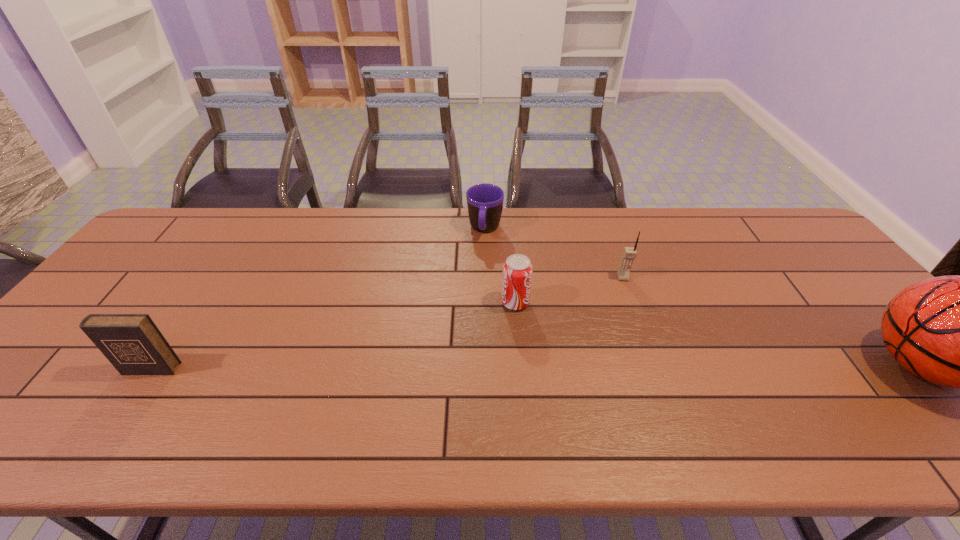
I want to click on free space located with the handle on the side of the farthest object, so click(477, 282).

This screenshot has height=540, width=960. In order to click on free space located 0.060m with the handle on the side of the farthest object in this screenshot , I will do `click(481, 258)`.

You are a GUI agent. You are given a task and a screenshot of the screen. Output one action in this format:
    pyautogui.click(x=<x>, y=<y>)
    Task: Click on the free spot located on the front of the fourth nearest object, where the keypad is located
    The height and width of the screenshot is (540, 960).
    Given the screenshot: What is the action you would take?
    pyautogui.click(x=648, y=392)

This screenshot has width=960, height=540. I want to click on vacant space located on the front of the fourth nearest object, where the keypad is located, so coord(637,344).

At what (x,y) coordinates should I click in order to perform the action: click on vacant area located 0.250m on the front of the fourth nearest object, where the keypad is located. Please return your answer as a coordinate pair (x, y). This screenshot has width=960, height=540. Looking at the image, I should click on (639, 350).

Locate an element on the screen. This screenshot has width=960, height=540. object present at the far edge is located at coordinates (485, 202).

Find the location of a particular element. The width and height of the screenshot is (960, 540). object present at the near edge is located at coordinates (132, 343).

Locate an element on the screen. The width and height of the screenshot is (960, 540). vacant space at the far edge of the desktop is located at coordinates point(330,208).

In the image, there is a desktop. Find the location of `vacant space at the near edge`. vacant space at the near edge is located at coordinates (374, 384).

This screenshot has width=960, height=540. I want to click on free space at the left edge of the desktop, so click(78, 357).